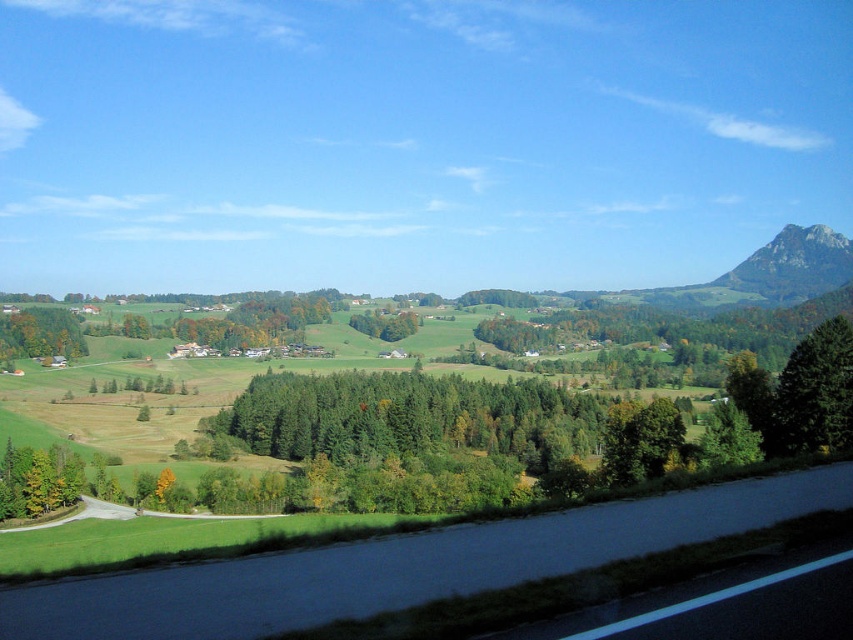
Is point (792, 353) positioned before point (814, 289)?

Yes, it is.

Is green matte tree at center-right behind rugged granite peak at upper right?

That is False.

The height and width of the screenshot is (640, 853). What do you see at coordinates (814, 394) in the screenshot?
I see `green matte tree at center-right` at bounding box center [814, 394].

Identify the location of green matte tree at center-right. This screenshot has width=853, height=640. (814, 394).

Is black asphalt road at lower center to the right of green matte tree at center from the viewer's perspective?

Correct, you'll find black asphalt road at lower center to the right of green matte tree at center.

Who is more forward, (380, 604) or (396, 314)?

Point (380, 604)

Measure the distance between point (309, 568) and camera.

Point (309, 568) is 29.11 feet from camera.

Where is `black asphalt road at lower center`? black asphalt road at lower center is located at coordinates (402, 564).

Can you confirm if rugged granite peak at upper right is positioned to the right of green matte tree at center?

Yes, rugged granite peak at upper right is to the right of green matte tree at center.

From the picture: Measure the distance between rugged granite peak at upper right and camera.

570.66 feet

Identify the location of rugged granite peak at upper right. The width and height of the screenshot is (853, 640). (793, 264).